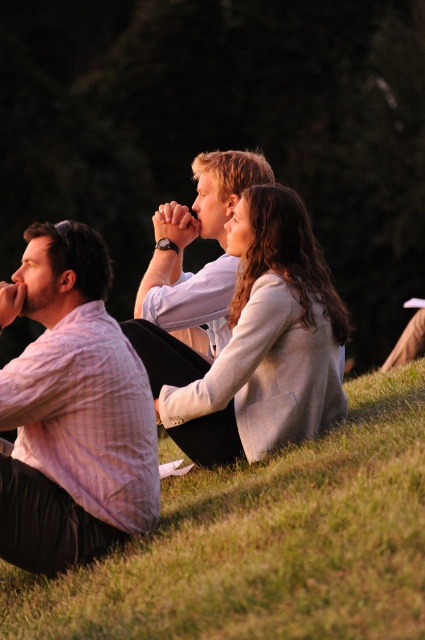
You are trying to decide whether to place a small picnic basket between the striped cotton shirt at left and the light beige sweater at center. Based on their positions, will the basket fit horizontally between them?

The striped cotton shirt at left is located below the light beige sweater at center, so placing a picnic basket horizontally between them would depend on their horizontal distance, which isn

You are planning to place a small picnic basket on the grassy area near the green grassy at lower left and the striped cotton shirt at left. Based on their sizes, which area would be more suitable for placing the basket?

The green grassy at lower left has a larger width than the striped cotton shirt at left, so it would be more suitable for placing the picnic basket as it provides a wider and more stable surface.

You are trying to find a spot to place a small picnic basket in the image. You want it to be between the green grassy at lower left and the light beige sweater at center. According to the scene description, which object should the basket be closer to?

The green grassy at lower left is positioned on the right side of light beige sweater at center. Therefore, the picnic basket should be placed closer to the light beige sweater at center since it is to the left of the green grassy at lower left.